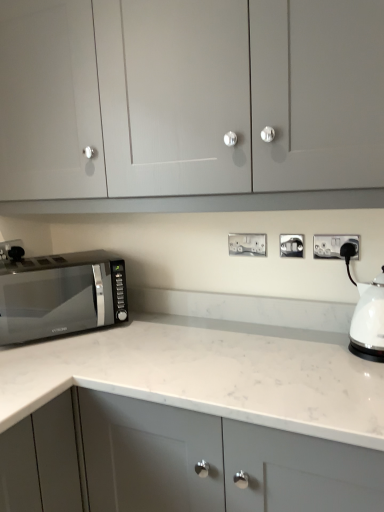
Question: From a real-world perspective, is satin silver socket at center, the 3th electric outlet from the back, on satin silver socket at lower left, arranged as the 1th electric outlet when viewed from the left?

Choices:
 (A) yes
 (B) no

Answer: (A)

Question: Is satin silver socket at center, the 3th electric outlet from the back, placed right next to satin silver socket at lower left, arranged as the 1th electric outlet when viewed from the left?

Choices:
 (A) no
 (B) yes

Answer: (A)

Question: Are satin silver socket at center, the 3th electric outlet from the back, and satin silver socket at lower left, the fourth electric outlet in the right-to-left sequence, located far from each other?

Choices:
 (A) yes
 (B) no

Answer: (A)

Question: Does satin silver socket at center, the 2th electric outlet from the front, have a lesser width compared to satin silver socket at lower left, the fourth electric outlet in the right-to-left sequence?

Choices:
 (A) no
 (B) yes

Answer: (A)

Question: Considering the relative sizes of satin silver socket at center, the third electric outlet in the left-to-right sequence, and satin silver socket at lower left, the fourth electric outlet in the right-to-left sequence, in the image provided, is satin silver socket at center, the third electric outlet in the left-to-right sequence, smaller than satin silver socket at lower left, the fourth electric outlet in the right-to-left sequence,?

Choices:
 (A) yes
 (B) no

Answer: (B)

Question: Can you confirm if satin silver socket at center, the 2th electric outlet from the front, is positioned to the right of satin silver socket at lower left, which is counted as the fourth electric outlet, starting from the front?

Choices:
 (A) no
 (B) yes

Answer: (B)

Question: Is matte gray cabinet at upper center turned away from satin black microwave at lower left?

Choices:
 (A) no
 (B) yes

Answer: (A)

Question: From a real-world perspective, is matte gray cabinet at upper center below satin black microwave at lower left?

Choices:
 (A) no
 (B) yes

Answer: (A)

Question: From the image's perspective, does matte gray cabinet at upper center appear lower than satin black microwave at lower left?

Choices:
 (A) yes
 (B) no

Answer: (B)

Question: Is matte gray cabinet at upper center far from satin black microwave at lower left?

Choices:
 (A) yes
 (B) no

Answer: (B)

Question: From a real-world perspective, is matte gray cabinet at upper center on satin black microwave at lower left?

Choices:
 (A) no
 (B) yes

Answer: (B)

Question: Can you confirm if matte gray cabinet at upper center is bigger than satin black microwave at lower left?

Choices:
 (A) no
 (B) yes

Answer: (B)

Question: Is satin silver socket at center, the 2th electric outlet from the front, shorter than white marble countertop at center?

Choices:
 (A) yes
 (B) no

Answer: (A)